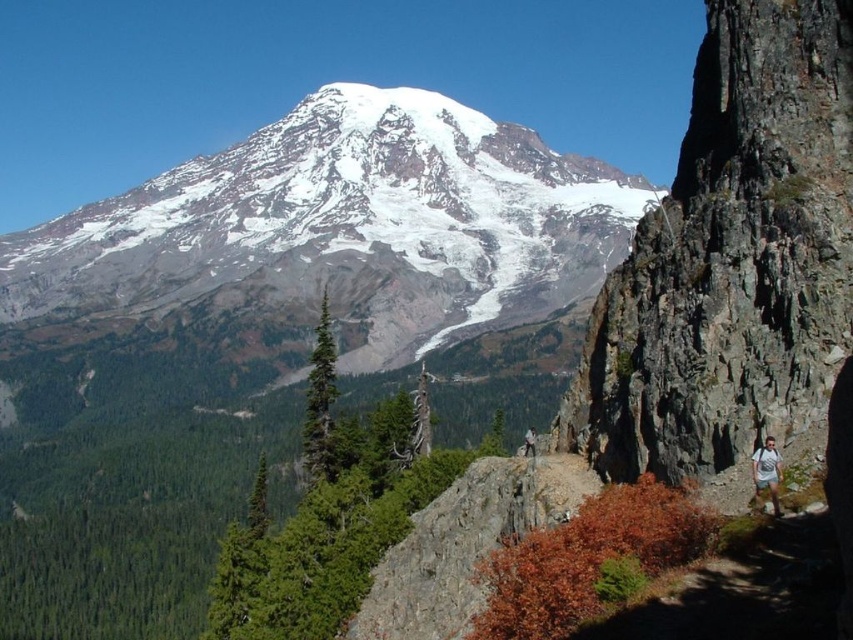
Between white cotton shirt at lower right and white cotton shirt at center-right, which one has less height?

Standing shorter between the two is white cotton shirt at lower right.

Between white cotton shirt at lower right and white cotton shirt at center-right, which one appears on the right side from the viewer's perspective?

From the viewer's perspective, white cotton shirt at lower right appears more on the right side.

Is point (775, 504) more distant than point (524, 445)?

No, (775, 504) is closer to viewer.

The height and width of the screenshot is (640, 853). Identify the location of white cotton shirt at lower right. (767, 472).

Consider the image. Which of these two, white snow-covered mountain at upper center or white cotton shirt at lower right, stands shorter?

With less height is white cotton shirt at lower right.

Is white snow-covered mountain at upper center bigger than white cotton shirt at lower right?

Correct, white snow-covered mountain at upper center is larger in size than white cotton shirt at lower right.

The width and height of the screenshot is (853, 640). Describe the element at coordinates (329, 234) in the screenshot. I see `white snow-covered mountain at upper center` at that location.

What are the coordinates of `white snow-covered mountain at upper center` in the screenshot? It's located at (329, 234).

Measure the distance from white snow-covered mountain at upper center to white cotton shirt at center-right.

They are 516.69 feet apart.

Is white snow-covered mountain at upper center to the right of white cotton shirt at center-right from the viewer's perspective?

No, white snow-covered mountain at upper center is not to the right of white cotton shirt at center-right.

Who is more forward, (32, 253) or (535, 435)?

Point (535, 435) is in front.

I want to click on white snow-covered mountain at upper center, so click(329, 234).